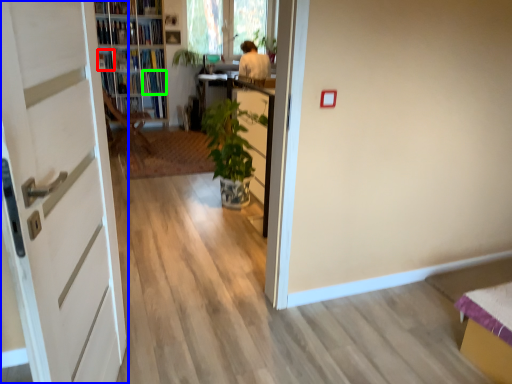
Question: Which is nearer to the book (highlighted by a red box)? door (highlighted by a blue box) or book (highlighted by a green box).

Choices:
 (A) door
 (B) book

Answer: (B)